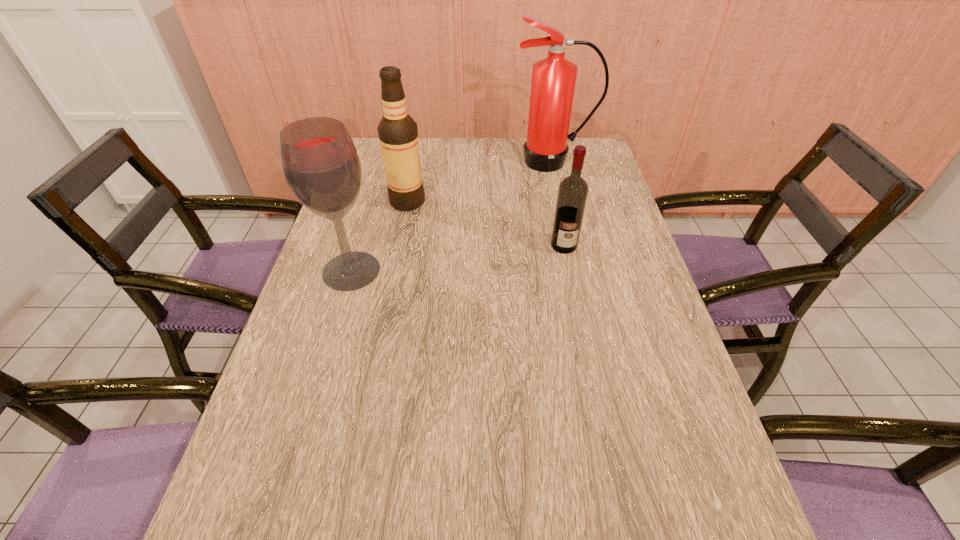
Find the location of a particular element. This screenshot has width=960, height=540. object located at the far right corner is located at coordinates (553, 82).

The image size is (960, 540). Find the location of `vacant space at the far edge of the desktop`. vacant space at the far edge of the desktop is located at coordinates (525, 170).

Find the location of `free space at the left edge`. free space at the left edge is located at coordinates (357, 215).

This screenshot has width=960, height=540. What are the coordinates of `blank space at the right edge of the desktop` in the screenshot? It's located at (715, 483).

You are a GUI agent. You are given a task and a screenshot of the screen. Output one action in this format:
    pyautogui.click(x=<x>, y=<y>)
    Task: Click on the blank space at the far left corner
    This screenshot has width=960, height=540.
    Given the screenshot: What is the action you would take?
    [x=373, y=155]

Image resolution: width=960 pixels, height=540 pixels. What are the coordinates of `free space between the farthest object and the third nearest object` in the screenshot? It's located at (480, 181).

Locate an element on the screen. free space between the farthest alcohol and the farthest object is located at coordinates (480, 181).

Identify the location of the third closest object to the farthest alcohol. This screenshot has height=540, width=960. (572, 194).

This screenshot has width=960, height=540. In order to click on object that can be found as the third closest to the shortest alcohol in this screenshot , I will do `click(320, 163)`.

Point out which alcohol is positioned as the nearest to the rightmost alcohol. Please provide its 2D coordinates. Your answer should be formatted as a tuple, i.e. [(x, y)], where the tuple contains the x and y coordinates of a point satisfying the conditions above.

[(398, 134)]